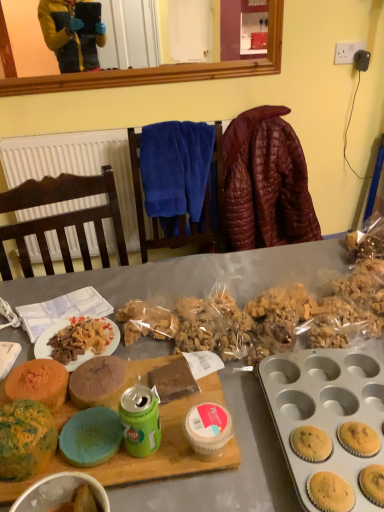
This screenshot has width=384, height=512. Identify the location of free spot above white matte plate at center (from a real-world perspective). (87, 329).